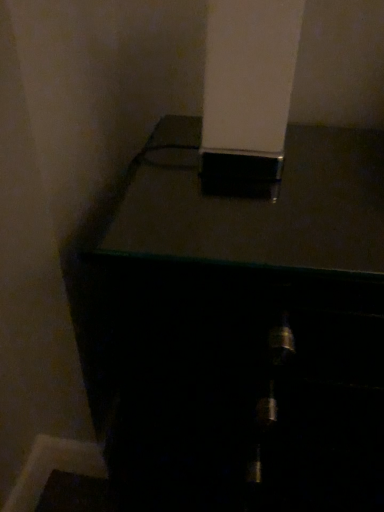
Question: Is white glossy pillar at upper center to the left or to the right of black glossy safe at upper center in the image?

Choices:
 (A) left
 (B) right

Answer: (A)

Question: From a real-world perspective, is white glossy pillar at upper center physically located above or below black glossy safe at upper center?

Choices:
 (A) above
 (B) below

Answer: (A)

Question: Would you say white glossy pillar at upper center is inside or outside black glossy safe at upper center?

Choices:
 (A) outside
 (B) inside

Answer: (A)

Question: In terms of width, does black glossy safe at upper center look wider or thinner when compared to white glossy pillar at upper center?

Choices:
 (A) thin
 (B) wide

Answer: (B)

Question: In the image, is black glossy safe at upper center positioned in front of or behind white glossy pillar at upper center?

Choices:
 (A) behind
 (B) front

Answer: (A)

Question: Is point [278, 496] positioned closer to the camera than point [248, 113]?

Choices:
 (A) farther
 (B) closer

Answer: (A)

Question: Based on their sizes in the image, would you say black glossy safe at upper center is bigger or smaller than white glossy pillar at upper center?

Choices:
 (A) big
 (B) small

Answer: (A)